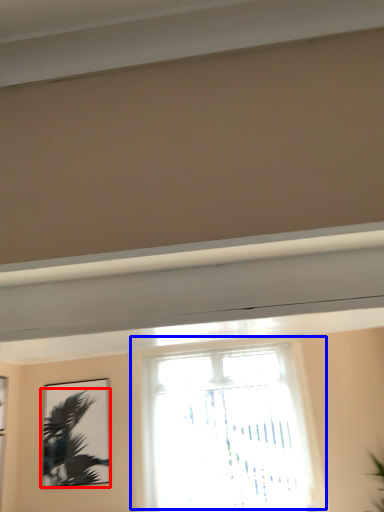
Question: Among these objects, which one is farthest to the camera, palm tree (highlighted by a red box) or window (highlighted by a blue box)?

Choices:
 (A) palm tree
 (B) window

Answer: (A)